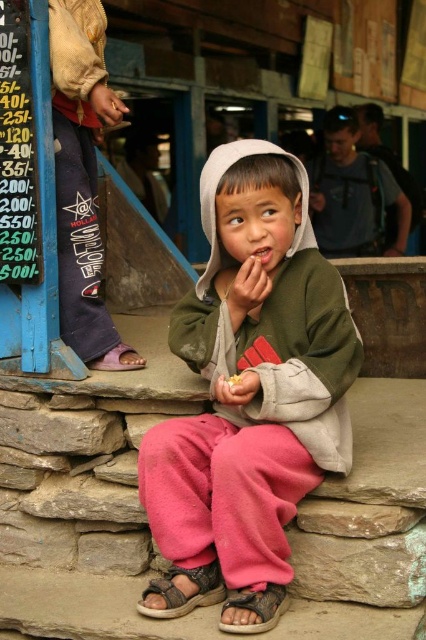
You are a parent looking for your child who is sitting on a stone step. You see the blue painted wood at upper left and the yellow crumbly food at center. Which object is closer to you?

The blue painted wood at upper left is closer to you because the yellow crumbly food at center is behind it.